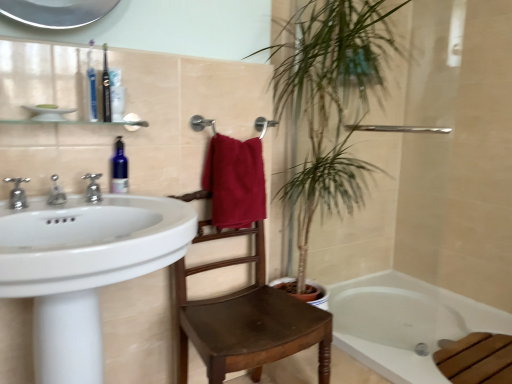
Question: Should I look upward or downward to see translucent plastic toothbrush at upper left, which is counted as the second toiletry, starting from the front?

Choices:
 (A) up
 (B) down

Answer: (A)

Question: Would you say translucent plastic toothbrush at upper left, placed as the first toiletry when sorted from back to front, contains green leafy plant at upper center?

Choices:
 (A) yes
 (B) no

Answer: (B)

Question: Is translucent plastic toothbrush at upper left, placed as the first toiletry when sorted from back to front, positioned before green leafy plant at upper center?

Choices:
 (A) yes
 (B) no

Answer: (B)

Question: Considering the relative sizes of translucent plastic toothbrush at upper left, which is counted as the second toiletry, starting from the front, and green leafy plant at upper center in the image provided, is translucent plastic toothbrush at upper left, which is counted as the second toiletry, starting from the front, wider than green leafy plant at upper center?

Choices:
 (A) yes
 (B) no

Answer: (B)

Question: Considering the relative sizes of translucent plastic toothbrush at upper left, which is counted as the second toiletry, starting from the front, and green leafy plant at upper center in the image provided, is translucent plastic toothbrush at upper left, which is counted as the second toiletry, starting from the front, smaller than green leafy plant at upper center?

Choices:
 (A) no
 (B) yes

Answer: (B)

Question: Considering the relative positions of translucent plastic toothbrush at upper left, which is counted as the second toiletry, starting from the front, and green leafy plant at upper center in the image provided, is translucent plastic toothbrush at upper left, which is counted as the second toiletry, starting from the front, to the left of green leafy plant at upper center from the viewer's perspective?

Choices:
 (A) yes
 (B) no

Answer: (A)

Question: Would you say translucent plastic toothbrush at upper left, which is counted as the second toiletry, starting from the front, is outside green leafy plant at upper center?

Choices:
 (A) yes
 (B) no

Answer: (A)

Question: Does white glossy bathtub at lower right lie in front of blue plastic toothbrush at upper left, acting as the 2th toiletry starting from the back?

Choices:
 (A) no
 (B) yes

Answer: (A)

Question: Is white glossy bathtub at lower right positioned beyond the bounds of blue plastic toothbrush at upper left, the 1th toiletry from the front?

Choices:
 (A) yes
 (B) no

Answer: (A)

Question: Is white glossy bathtub at lower right smaller than blue plastic toothbrush at upper left, the 1th toiletry from the front?

Choices:
 (A) no
 (B) yes

Answer: (A)

Question: Can you confirm if white glossy bathtub at lower right is positioned to the right of blue plastic toothbrush at upper left, acting as the 2th toiletry starting from the back?

Choices:
 (A) yes
 (B) no

Answer: (A)

Question: From the image's perspective, would you say white glossy bathtub at lower right is positioned over blue plastic toothbrush at upper left, the 1th toiletry from the front?

Choices:
 (A) yes
 (B) no

Answer: (B)

Question: Can you confirm if white glossy bathtub at lower right is bigger than blue plastic toothbrush at upper left, acting as the 2th toiletry starting from the back?

Choices:
 (A) yes
 (B) no

Answer: (A)

Question: Is the position of silver metallic faucet at left, marked as the second tap in a left-to-right arrangement, more distant than that of white glossy sink at left?

Choices:
 (A) no
 (B) yes

Answer: (B)